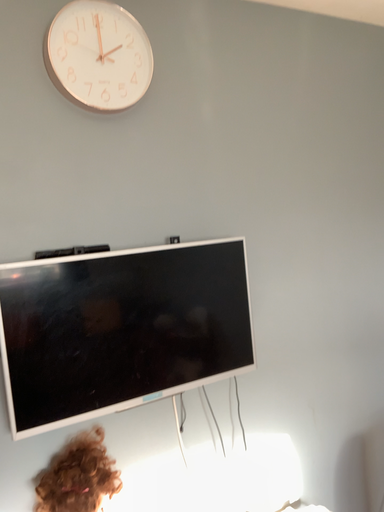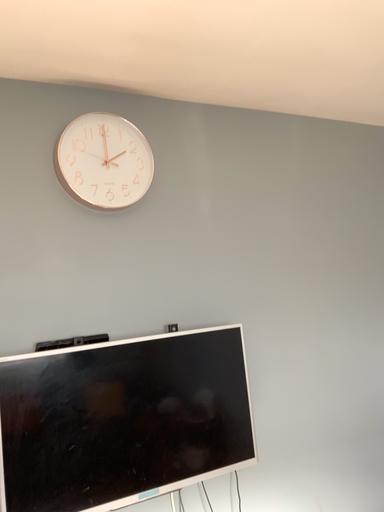
Question: How did the camera likely rotate when shooting the video?

Choices:
 (A) rotated upward
 (B) rotated downward

Answer: (A)